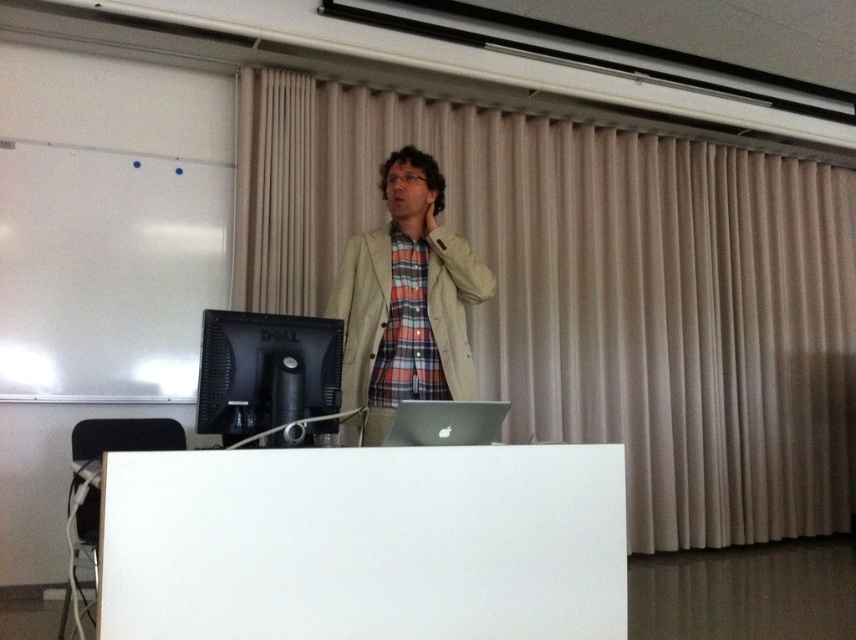
Question: Does beige fabric curtain at upper center appear over white matte table at center?

Choices:
 (A) yes
 (B) no

Answer: (A)

Question: Which of the following is the closest to the observer?

Choices:
 (A) (233, 636)
 (B) (676, 218)
 (C) (452, 436)
 (D) (456, 320)

Answer: (A)

Question: Can you confirm if white matte table at center is positioned to the left of sleek silver laptop at center?

Choices:
 (A) yes
 (B) no

Answer: (A)

Question: Can you confirm if beige fabric curtain at upper center is positioned above light beige fabric jacket at center?

Choices:
 (A) no
 (B) yes

Answer: (B)

Question: Based on their relative distances, which object is nearer to the sleek silver laptop at center?

Choices:
 (A) light beige fabric jacket at center
 (B) beige fabric curtain at upper center
 (C) black glossy monitor at lower left
 (D) white matte table at center

Answer: (D)

Question: Estimate the real-world distances between objects in this image. Which object is closer to the beige fabric curtain at upper center?

Choices:
 (A) white matte table at center
 (B) sleek silver laptop at center
 (C) black glossy monitor at lower left
 (D) light beige fabric jacket at center

Answer: (D)